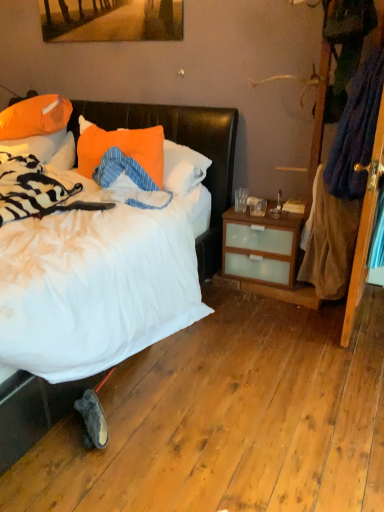
Question: From the image's perspective, relative to orange fabric pillow at center, marked as the third pillow in a left-to-right arrangement, is matte wooden picture frame at upper center above or below?

Choices:
 (A) above
 (B) below

Answer: (A)

Question: In terms of height, does matte wooden picture frame at upper center look taller or shorter compared to orange fabric pillow at center, marked as the third pillow in a left-to-right arrangement?

Choices:
 (A) tall
 (B) short

Answer: (B)

Question: Based on their relative distances, which object is farther from the orange fabric pillow at center, the 1th pillow from the right?

Choices:
 (A) dark gray suede sneaker at lower left
 (B) orange fabric pillow at upper left, the first pillow positioned from the left
 (C) orange fabric pillow at upper left, which is counted as the second pillow, starting from the left
 (D) wooden screen door at right
 (E) white soft bed at left

Answer: (A)

Question: Which object is the closest to the white soft bed at left?

Choices:
 (A) dark gray suede sneaker at lower left
 (B) wooden screen door at right
 (C) orange fabric pillow at center, marked as the third pillow in a left-to-right arrangement
 (D) matte wooden picture frame at upper center
 (E) orange fabric pillow at upper left, the 3th pillow in the right-to-left sequence

Answer: (C)